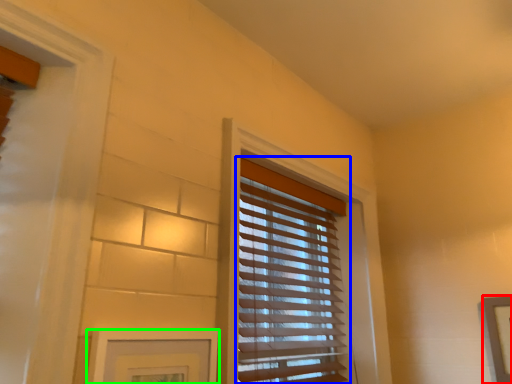
Question: Considering the real-world distances, which object is farthest from picture frame (highlighted by a red box)? window blind (highlighted by a blue box) or picture frame (highlighted by a green box)?

Choices:
 (A) window blind
 (B) picture frame

Answer: (B)